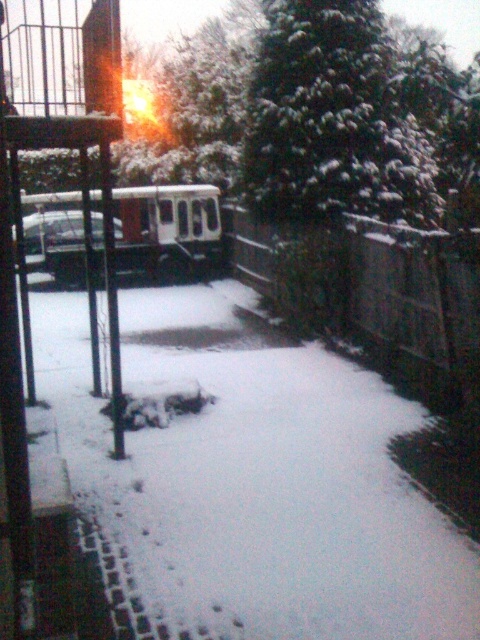
Question: Is white matte train at center closer to the viewer compared to metallic silver car at left?

Choices:
 (A) yes
 (B) no

Answer: (B)

Question: Does snow-covered evergreen at upper center have a lesser width compared to white matte train at center?

Choices:
 (A) no
 (B) yes

Answer: (A)

Question: Does snow-covered evergreen at upper center have a greater width compared to white matte train at center?

Choices:
 (A) no
 (B) yes

Answer: (B)

Question: Estimate the real-world distances between objects in this image. Which object is closer to the white matte train at center?

Choices:
 (A) snow-covered evergreen at upper center
 (B) metallic silver car at left

Answer: (B)

Question: Which object is farther from the camera taking this photo?

Choices:
 (A) white matte train at center
 (B) snow-covered evergreen at upper center

Answer: (A)

Question: Which is nearer to the metallic silver car at left?

Choices:
 (A) snow-covered evergreen at upper center
 (B) white matte train at center

Answer: (B)